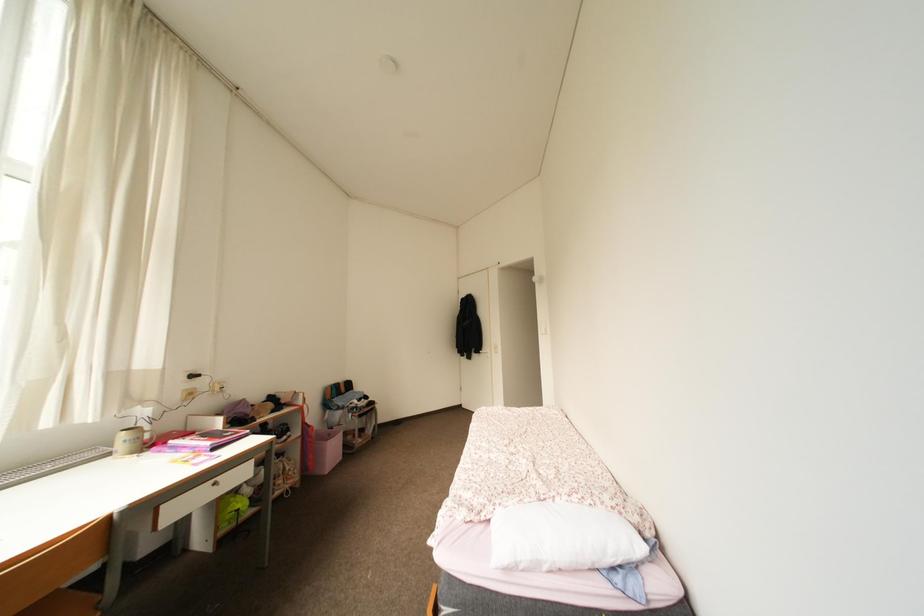
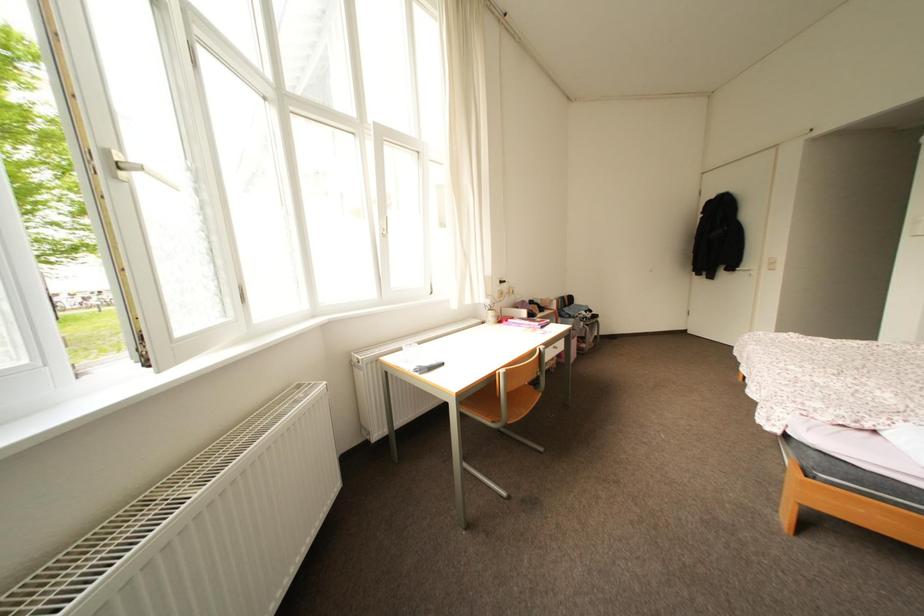
First-person continuous shooting, in which direction is the camera rotating?

The rotation direction of the camera is left-down.